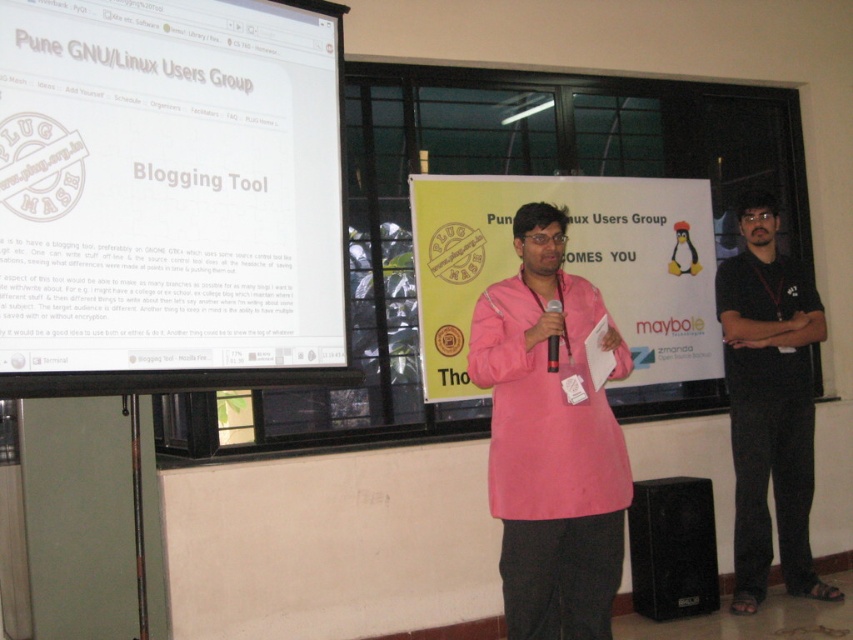
Where is `pink fabric kurta at center`? Image resolution: width=853 pixels, height=640 pixels. pink fabric kurta at center is located at coordinates (549, 442).

You are a GUI agent. You are given a task and a screenshot of the screen. Output one action in this format:
    pyautogui.click(x=<x>, y=<y>)
    Task: Click on the pink fabric kurta at center
    
    Given the screenshot: What is the action you would take?
    pyautogui.click(x=549, y=442)

Is white glossy projector screen at upper left positioned at the back of pink fabric kurta at center?

No, white glossy projector screen at upper left is closer to the viewer.

Does point (161, 308) come behind point (554, 280)?

No, (161, 308) is in front of (554, 280).

Locate an element on the screen. white glossy projector screen at upper left is located at coordinates (169, 195).

Is point (242, 253) farther from viewer compared to point (547, 310)?

No, (242, 253) is in front of (547, 310).

From the picture: Can you confirm if white glossy projector screen at upper left is smaller than black matte microphone at center?

No, white glossy projector screen at upper left is not smaller than black matte microphone at center.

Between point (97, 168) and point (556, 340), which one is positioned in front?

Point (97, 168) is in front.

Where is `white glossy projector screen at upper left`? This screenshot has height=640, width=853. white glossy projector screen at upper left is located at coordinates (169, 195).